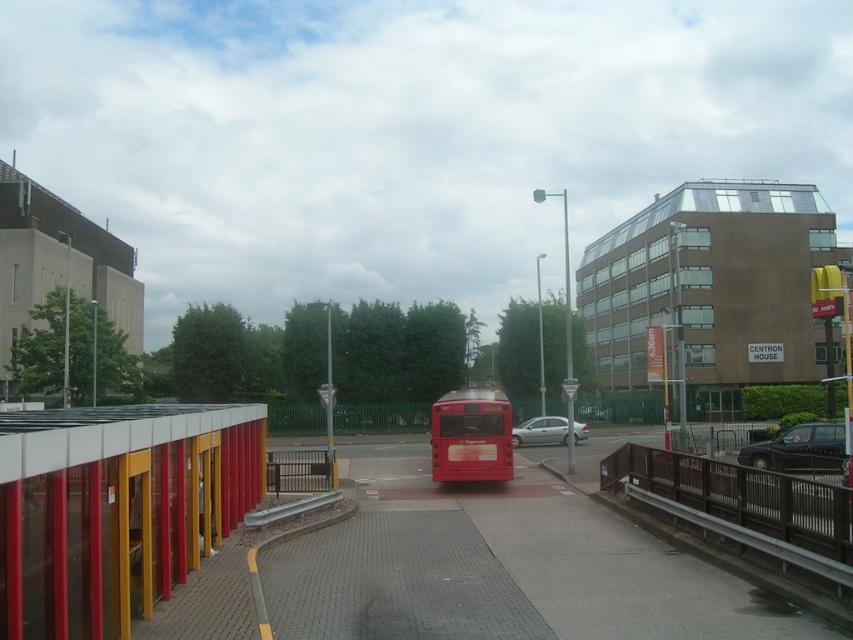
Looking at this image, who is higher up, shiny red bus at center or silver metallic car at center?

Positioned higher is shiny red bus at center.

Does shiny red bus at center appear on the right side of silver metallic car at center?

No, shiny red bus at center is not to the right of silver metallic car at center.

The height and width of the screenshot is (640, 853). What do you see at coordinates (471, 436) in the screenshot?
I see `shiny red bus at center` at bounding box center [471, 436].

Identify the location of shiny red bus at center. The height and width of the screenshot is (640, 853). (471, 436).

Between point (456, 438) and point (746, 458), which one is positioned behind?

Point (746, 458)

Is shiny red bus at center taller than black metallic car at lower right?

Correct, shiny red bus at center is much taller as black metallic car at lower right.

Is point (485, 470) positioned behind point (753, 454)?

No, (485, 470) is closer to viewer.

Locate an element on the screen. The width and height of the screenshot is (853, 640). shiny red bus at center is located at coordinates coord(471,436).

Can you confirm if metallic red bus stop at left is thinner than shiny red bus at center?

Yes.

Who is taller, metallic red bus stop at left or shiny red bus at center?

With more height is shiny red bus at center.

Does point (157, 438) come behind point (434, 458)?

No, it is in front of (434, 458).

Locate an element on the screen. The image size is (853, 640). metallic red bus stop at left is located at coordinates (115, 508).